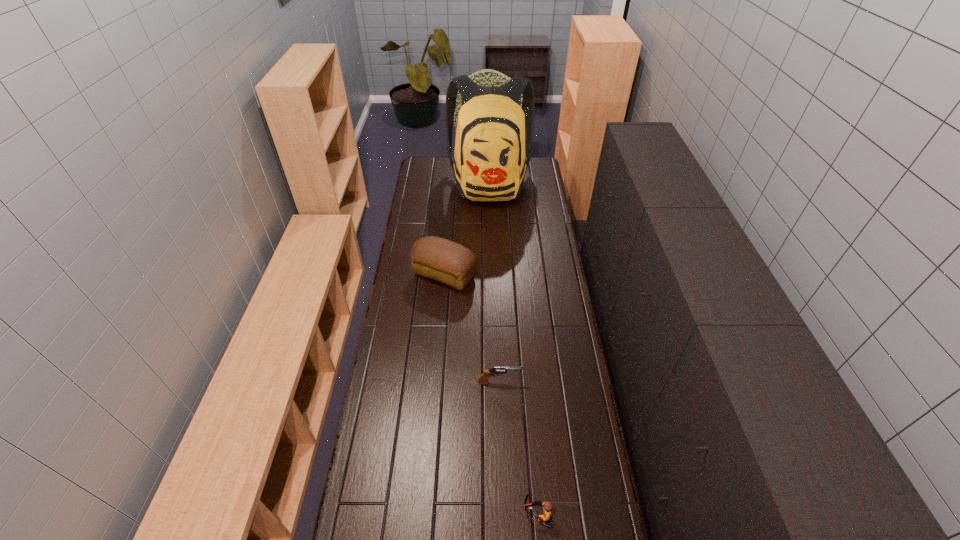
Find the location of a particular element. the tallest object is located at coordinates (490, 163).

Locate an element on the screen. This screenshot has width=960, height=540. the farthest object is located at coordinates (490, 163).

Where is `the third nearest object`? The width and height of the screenshot is (960, 540). the third nearest object is located at coordinates (443, 260).

Image resolution: width=960 pixels, height=540 pixels. Find the location of `the second tallest object`. the second tallest object is located at coordinates (443, 260).

I want to click on the second nearest object, so click(x=483, y=379).

I want to click on Lego, so click(x=547, y=506).

This screenshot has width=960, height=540. I want to click on vacant space located 0.210m on the front-facing side of the tallest object, so click(x=491, y=238).

The height and width of the screenshot is (540, 960). Identify the location of free space located on the back of the third shortest object. (446, 250).

Where is `vacant area located 0.200m along the barrel of the third farthest object`? The width and height of the screenshot is (960, 540). vacant area located 0.200m along the barrel of the third farthest object is located at coordinates (577, 382).

Image resolution: width=960 pixels, height=540 pixels. Find the location of `vacant space located 0.130m holding a crossbow in the hands of the nearest object`. vacant space located 0.130m holding a crossbow in the hands of the nearest object is located at coordinates (479, 514).